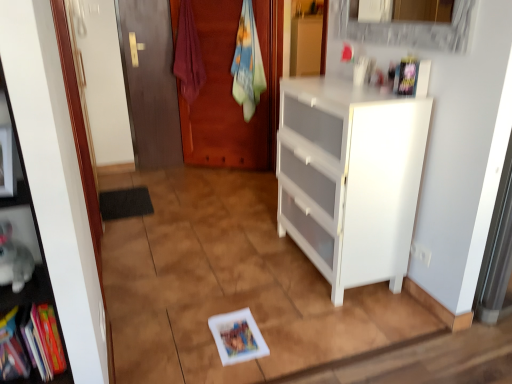
Where is `vacant space underneath multicolored fabric towel at center, which is counted as the first laundry, starting from the right (from a real-world perspective)`? vacant space underneath multicolored fabric towel at center, which is counted as the first laundry, starting from the right (from a real-world perspective) is located at coordinates (247, 172).